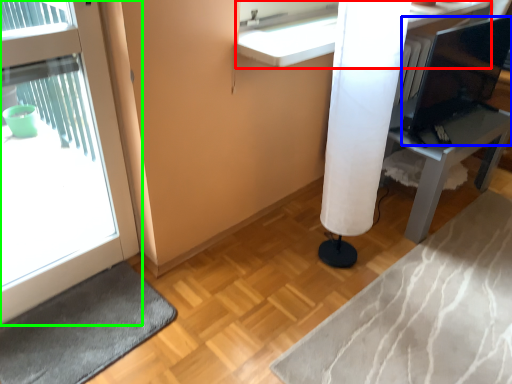
Question: Which object is the farthest from counter (highlighted by a red box)? Choose among these: computer monitor (highlighted by a blue box) or door (highlighted by a green box).

Choices:
 (A) computer monitor
 (B) door

Answer: (A)